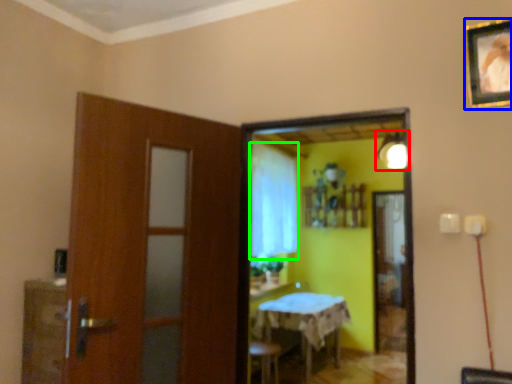
Question: Estimate the real-world distances between objects in this image. Which object is farther from light fixture (highlighted by a red box), picture frame (highlighted by a blue box) or curtain (highlighted by a green box)?

Choices:
 (A) picture frame
 (B) curtain

Answer: (A)